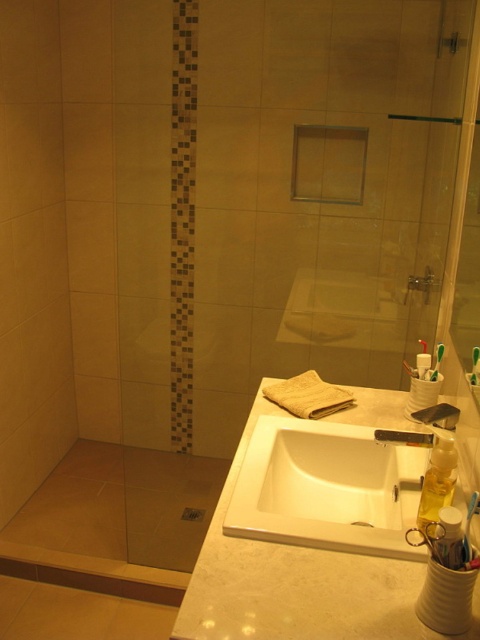
Question: Which of the following is the closest to the observer?

Choices:
 (A) silver metallic faucet at sink right
 (B) white marble sink at center

Answer: (B)

Question: Observing the image, what is the correct spatial positioning of white marble sink at center in reference to white glossy sink at center?

Choices:
 (A) left
 (B) right

Answer: (B)

Question: Does translucent yellow liquid at sink right have a larger size compared to silver metallic faucet at sink right?

Choices:
 (A) yes
 (B) no

Answer: (A)

Question: Is white marble sink at center to the left of silver metallic faucet at sink right from the viewer's perspective?

Choices:
 (A) yes
 (B) no

Answer: (A)

Question: Which of these objects is positioned farthest from the white glossy sink at center?

Choices:
 (A) translucent yellow liquid at sink right
 (B) white marble sink at center
 (C) silver metallic faucet at sink right

Answer: (C)

Question: Among these points, which one is nearest to the camera?

Choices:
 (A) (228, 547)
 (B) (327, 500)
 (C) (405, 440)

Answer: (A)